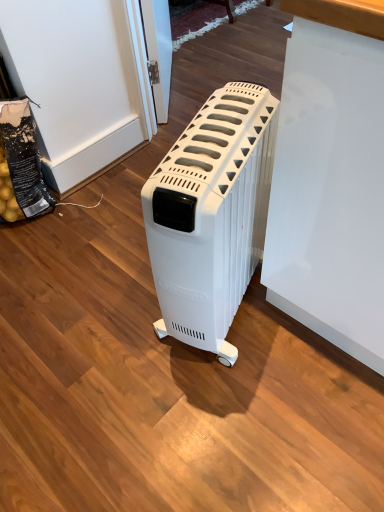
This screenshot has height=512, width=384. Identify the location of vacant space to the right of white plastic heater at center. (302, 342).